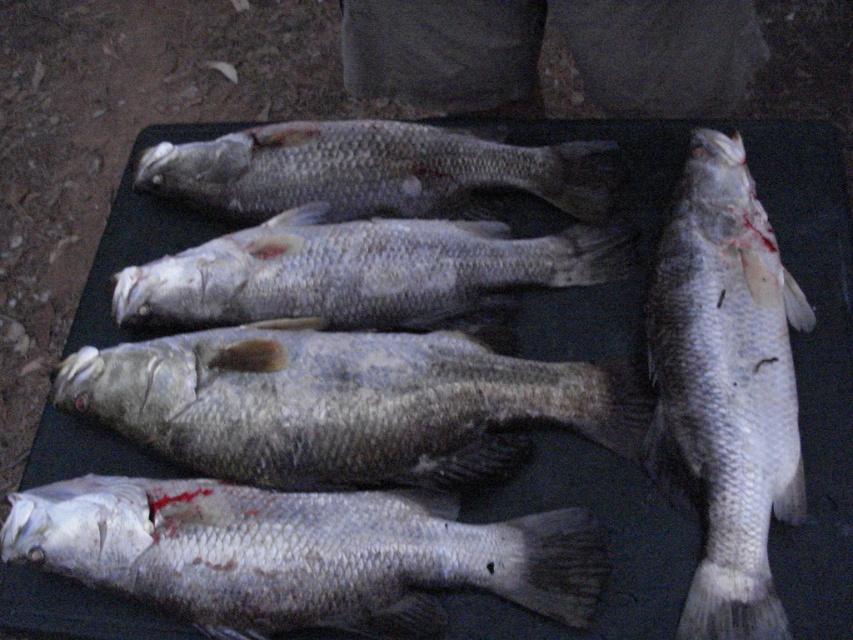
The width and height of the screenshot is (853, 640). Find the location of `grayish silver fish at center`. grayish silver fish at center is located at coordinates (341, 404).

Is point (210, 401) in front of point (291, 230)?

Yes, it is in front of point (291, 230).

Is point (196, 400) farther from camera compared to point (131, 314)?

No.

The image size is (853, 640). I want to click on grayish silver fish at center, so click(341, 404).

Who is positioned more to the left, silvery metallic fish at center or silver/glossy fish at center?

Positioned to the left is silver/glossy fish at center.

Is silvery metallic fish at center positioned behind silver/glossy fish at center?

No, it is in front of silver/glossy fish at center.

Does point (341, 234) lie behind point (247, 141)?

No, (341, 234) is closer to viewer.

The height and width of the screenshot is (640, 853). Find the location of `silvery metallic fish at center`. silvery metallic fish at center is located at coordinates (358, 272).

Who is lower down, silver textured fish at center or silver/glossy fish at center?

Positioned lower is silver textured fish at center.

Between silver textured fish at center and silver/glossy fish at center, which one has less height?

Standing shorter between the two is silver/glossy fish at center.

Identify the location of silver textured fish at center. The height and width of the screenshot is (640, 853). pyautogui.click(x=726, y=385).

This screenshot has width=853, height=640. I want to click on silver textured fish at center, so click(x=726, y=385).